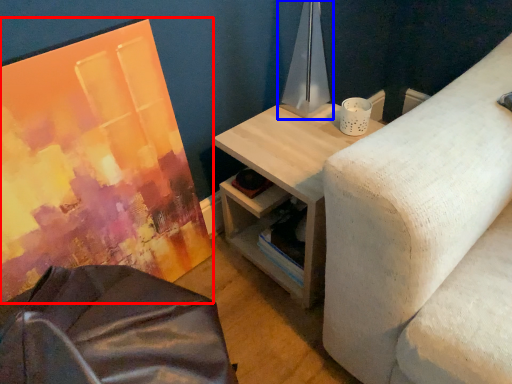
Question: Which point is further to the camera, canvas (highlighted by a red box) or table lamp (highlighted by a blue box)?

Choices:
 (A) canvas
 (B) table lamp

Answer: (B)